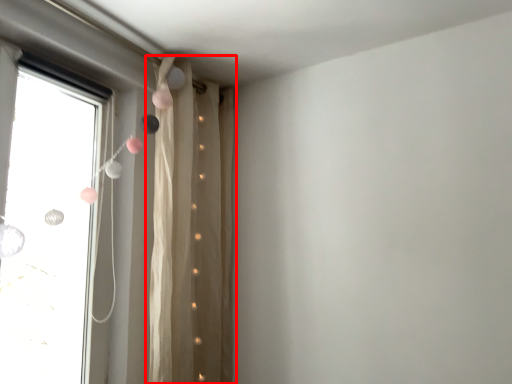
Question: From the image's perspective, what is the correct spatial positioning of curtain (annotated by the red box) in reference to window?

Choices:
 (A) below
 (B) above

Answer: (A)